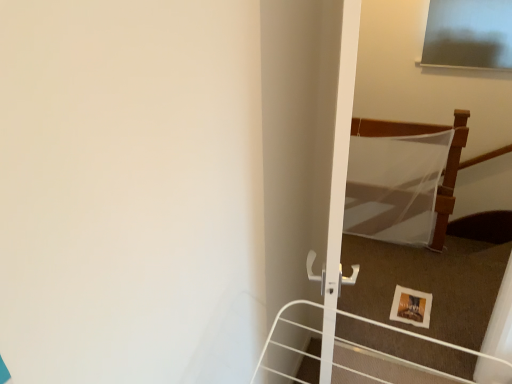
The image size is (512, 384). I want to click on vacant region above wooden picture frame at lower right (from a real-world perspective), so click(417, 305).